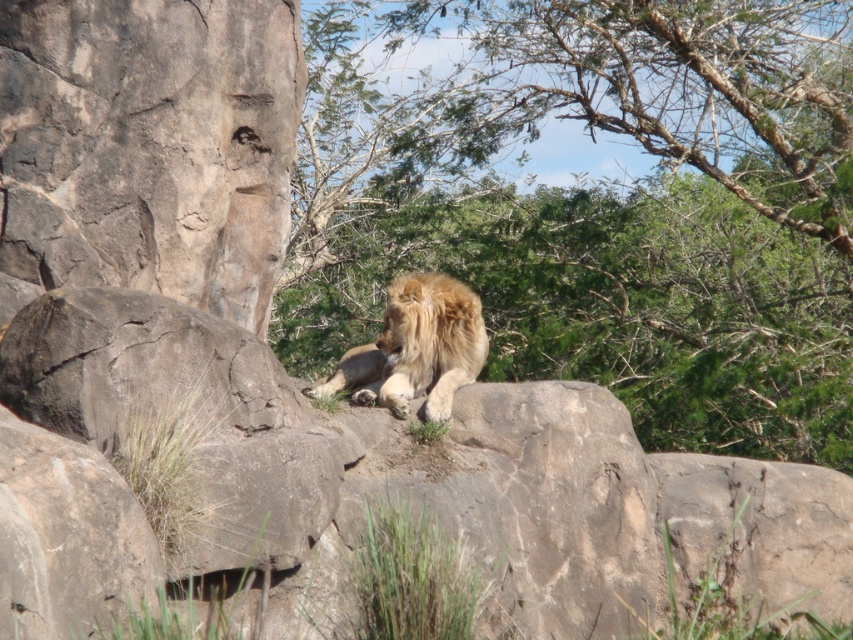
Question: Does green leafy tree at upper center appear on the right side of golden fur lion at center?

Choices:
 (A) no
 (B) yes

Answer: (B)

Question: Which of the following is the closest to the observer?

Choices:
 (A) green leafy tree at upper center
 (B) golden fur lion at center

Answer: (B)

Question: Does green leafy tree at upper center appear on the right side of golden fur lion at center?

Choices:
 (A) yes
 (B) no

Answer: (A)

Question: Can you confirm if green leafy tree at upper center is positioned above golden fur lion at center?

Choices:
 (A) yes
 (B) no

Answer: (A)